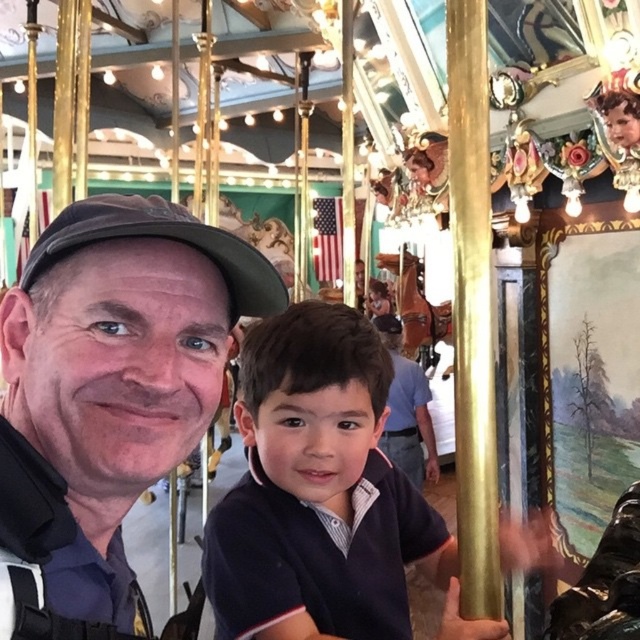
Between matte black cap at left and dark blue shirt at center, which one is positioned lower?

dark blue shirt at center

Between matte black cap at left and dark blue shirt at center, which one appears on the left side from the viewer's perspective?

Positioned to the left is matte black cap at left.

Is point (67, 384) positioned in front of point (323, 522)?

Yes, it is.

Locate an element on the screen. The image size is (640, 640). matte black cap at left is located at coordinates [x=120, y=365].